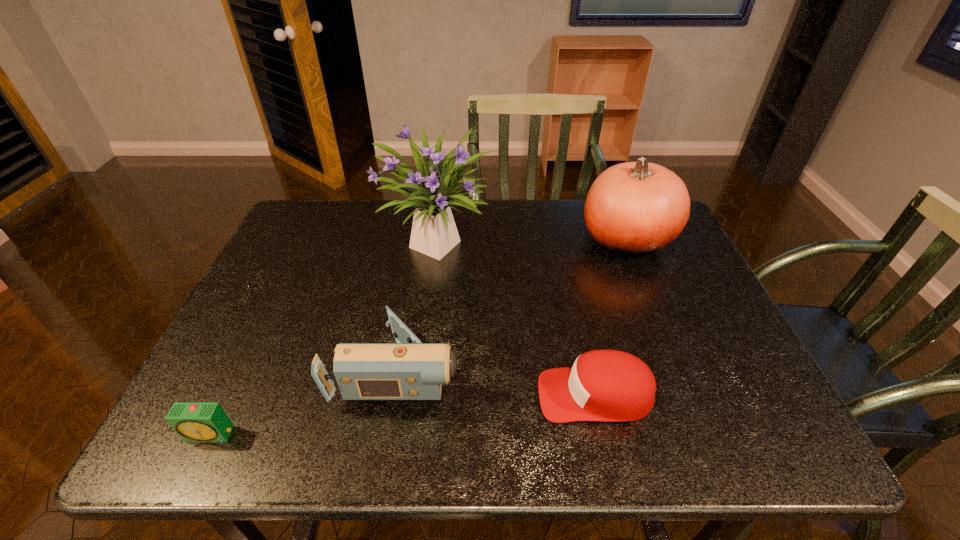
At what (x,y) coordinates should I click in order to perform the action: click on object situated at the far right corner. Please return your answer as a coordinate pair (x, y). The image size is (960, 540). Looking at the image, I should click on (633, 208).

This screenshot has width=960, height=540. Identify the location of vacant space at the far edge of the desktop. (375, 223).

In the image, there is a desktop. Identify the location of vacant space at the near edge. The width and height of the screenshot is (960, 540). (334, 418).

This screenshot has width=960, height=540. Identify the location of vacant area at the left edge. (280, 325).

At what (x,y) coordinates should I click in order to perform the action: click on free location at the right edge of the desktop. Please return your answer as a coordinate pair (x, y). The image size is (960, 540). Looking at the image, I should click on (695, 274).

This screenshot has width=960, height=540. In the image, there is a desktop. Identify the location of free space at the far left corner. (300, 238).

You are a GUI agent. You are given a task and a screenshot of the screen. Output one action in this format:
    pyautogui.click(x=<x>, y=<y>)
    Task: Click on the vacant area that lies between the second tallest object and the baseball cap
    This screenshot has width=960, height=540.
    Given the screenshot: What is the action you would take?
    pyautogui.click(x=611, y=316)

You are a GUI agent. You are given a task and a screenshot of the screen. Output one action in this format:
    pyautogui.click(x=<x>, y=<y>)
    Task: Click on the free area in between the baseball cap and the camcorder
    The width and height of the screenshot is (960, 540).
    Given the screenshot: What is the action you would take?
    pyautogui.click(x=496, y=382)

Find the location of `blank region between the baseball cap and the third tallest object`. blank region between the baseball cap and the third tallest object is located at coordinates (496, 382).

Identify the location of empty location between the alarm clock and the baseball cap. (402, 415).